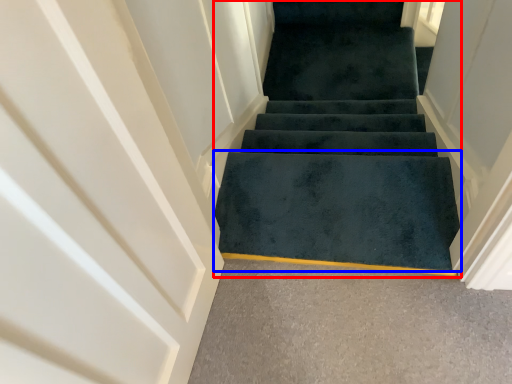
Question: Which of the following is the farthest to the observer, stairs (highlighted by a red box) or doormat (highlighted by a blue box)?

Choices:
 (A) stairs
 (B) doormat

Answer: (B)